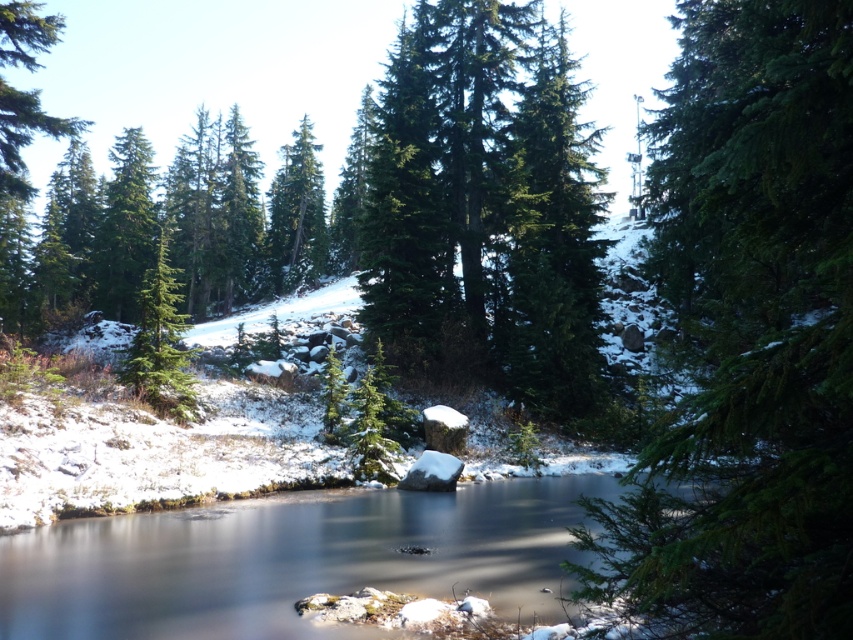
You are standing in the winter forest and want to take a photo of both the green matte tree at upper left and the green matte evergreen tree at left. Which tree should you focus on first to ensure both are in clear view?

You should focus on the green matte tree at upper left first because it is closer to you than the green matte evergreen tree at left, ensuring both are in clear view.